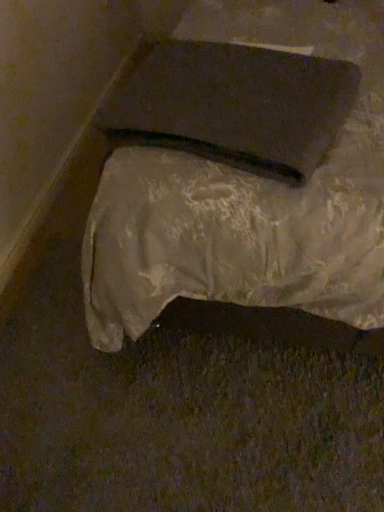
Question: Is matte black pad at upper center far from white fabric-covered object at center?

Choices:
 (A) no
 (B) yes

Answer: (A)

Question: Does matte black pad at upper center have a smaller size compared to white fabric-covered object at center?

Choices:
 (A) yes
 (B) no

Answer: (A)

Question: From the image's perspective, is matte black pad at upper center on top of white fabric-covered object at center?

Choices:
 (A) yes
 (B) no

Answer: (B)

Question: Could you tell me if matte black pad at upper center is facing white fabric-covered object at center?

Choices:
 (A) yes
 (B) no

Answer: (A)

Question: From a real-world perspective, is matte black pad at upper center positioned over white fabric-covered object at center based on gravity?

Choices:
 (A) no
 (B) yes

Answer: (B)

Question: Is the depth of matte black pad at upper center greater than that of white fabric-covered object at center?

Choices:
 (A) no
 (B) yes

Answer: (B)

Question: From a real-world perspective, is white fabric-covered object at center on top of matte black pad at upper center?

Choices:
 (A) yes
 (B) no

Answer: (B)

Question: Is white fabric-covered object at center smaller than matte black pad at upper center?

Choices:
 (A) yes
 (B) no

Answer: (B)

Question: Is white fabric-covered object at center closer to the viewer compared to matte black pad at upper center?

Choices:
 (A) no
 (B) yes

Answer: (B)

Question: Is white fabric-covered object at center positioned with its back to matte black pad at upper center?

Choices:
 (A) no
 (B) yes

Answer: (A)

Question: From the image's perspective, would you say white fabric-covered object at center is shown under matte black pad at upper center?

Choices:
 (A) no
 (B) yes

Answer: (A)

Question: Can you confirm if white fabric-covered object at center is shorter than matte black pad at upper center?

Choices:
 (A) yes
 (B) no

Answer: (B)

Question: In terms of size, does matte black pad at upper center appear bigger or smaller than white fabric-covered object at center?

Choices:
 (A) small
 (B) big

Answer: (A)